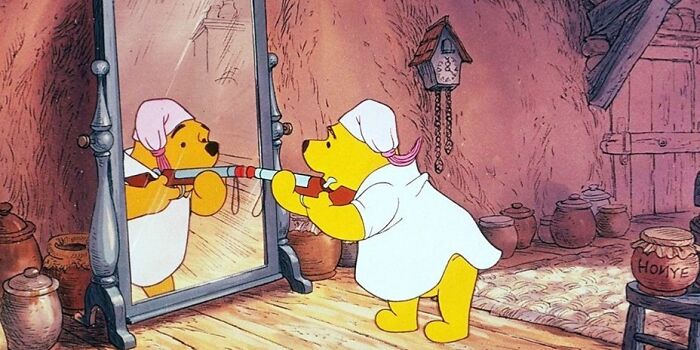
Find the location of a particular element. wood door is located at coordinates (650, 117).